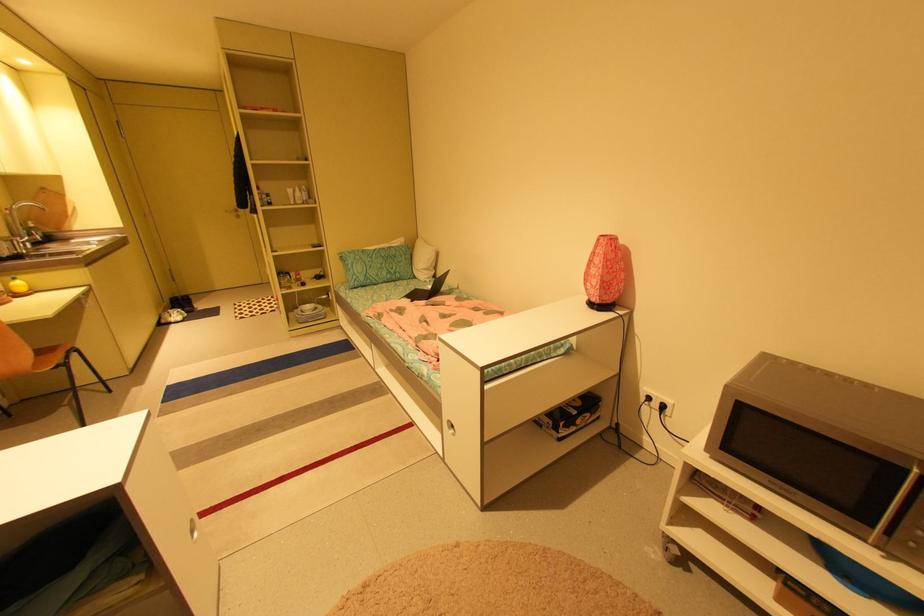
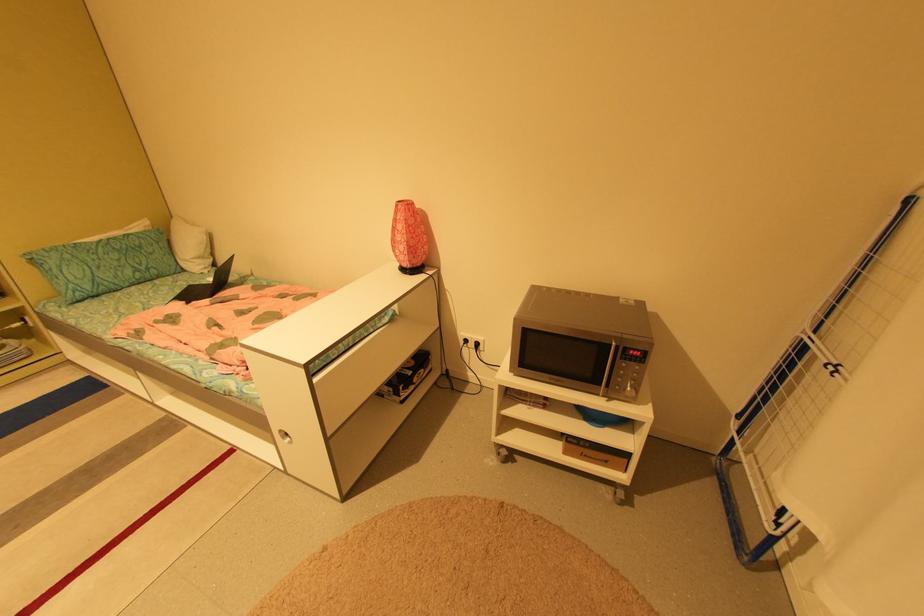
Locate, in the second image, the point that corresponds to point (879, 528) in the first image.

(606, 386)